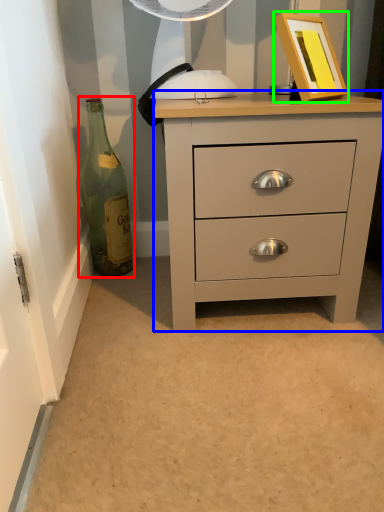
Question: Which object is positioned closest to bottle (highlighted by a red box)? Select from chest of drawers (highlighted by a blue box) and picture frame (highlighted by a green box).

Choices:
 (A) chest of drawers
 (B) picture frame

Answer: (A)